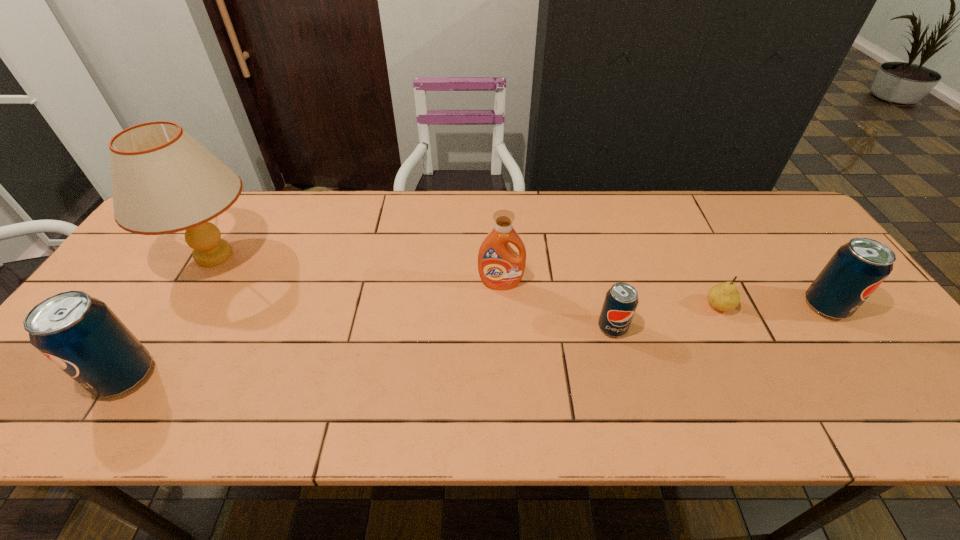
The image size is (960, 540). I want to click on empty space that is in between the nearest soda can and the detergent, so pos(313,330).

What are the coordinates of `free space between the second shortest object and the rightmost soda can` in the screenshot? It's located at (719, 317).

Identify the location of free space that is in between the second soda can from right to left and the second shortest soda can. The width and height of the screenshot is (960, 540). (719, 317).

Where is `vacant space in between the leftmost soda can and the fourth object from right to left`? vacant space in between the leftmost soda can and the fourth object from right to left is located at coordinates (313, 330).

In order to click on free space between the tallest object and the detergent in this screenshot , I will do `click(357, 269)`.

You are a GUI agent. You are given a task and a screenshot of the screen. Output one action in this format:
    pyautogui.click(x=<x>, y=<y>)
    Task: Click on the free space between the second soda can from left to right and the fourth object from right to left
    The width and height of the screenshot is (960, 540).
    Given the screenshot: What is the action you would take?
    pyautogui.click(x=557, y=306)

This screenshot has height=540, width=960. Find the location of `free point between the third shortest object and the pear`. free point between the third shortest object and the pear is located at coordinates (x=772, y=306).

Point out which object is positioned as the second nearest to the lampshade. Please provide its 2D coordinates. Your answer should be formatted as a tuple, i.e. [(x, y)], where the tuple contains the x and y coordinates of a point satisfying the conditions above.

[(500, 268)]

The width and height of the screenshot is (960, 540). Identify the location of object that is the fifth closest one to the pear. (80, 334).

Image resolution: width=960 pixels, height=540 pixels. I want to click on soda can that is the third closest to the tallest object, so [855, 271].